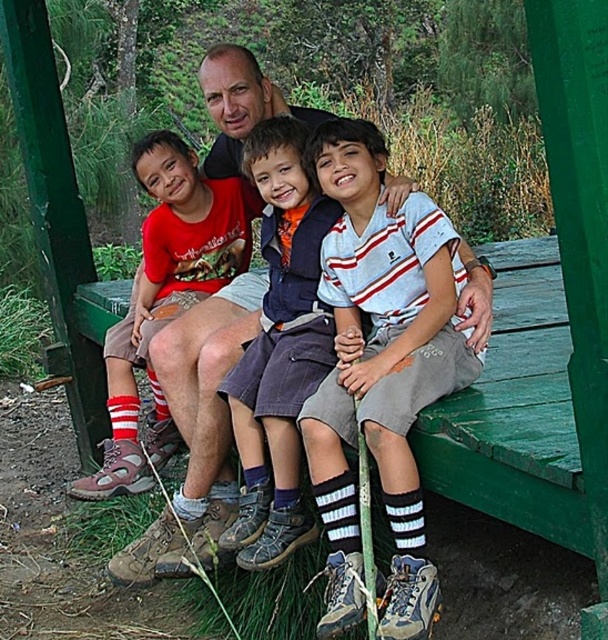
You are standing at the point labeled as point [206,397]. What object is located exactly at this coordinate?

The point [206,397] corresponds to matte brown shoes at center.

You are a photographer taking a group photo of the striped cotton shirt at center and the red cotton shirt at center. Which shirt should you position to the left to ensure both are framed properly?

The red cotton shirt at center should be positioned to the left since the striped cotton shirt at center is currently to the right of it.

Where is the striped cotton shirt at center located in the image?

The striped cotton shirt at center is located at point coordinates of approximately 0.542 on the x axis and 0.461 on the y axis.